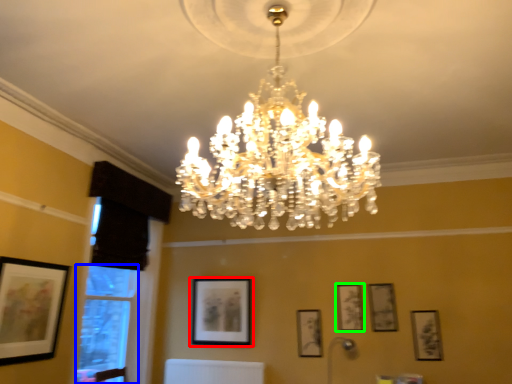
Question: Estimate the real-world distances between objects in this image. Which object is farther from picture frame (highlighted by a red box), window (highlighted by a blue box) or picture frame (highlighted by a green box)?

Choices:
 (A) window
 (B) picture frame

Answer: (B)